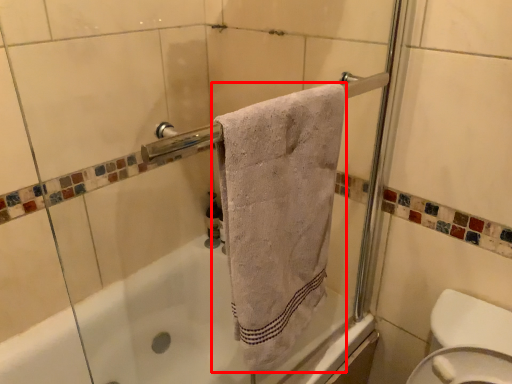
Question: From the image, what is the correct spatial relationship of towel (annotated by the red box) in relation to toiletry?

Choices:
 (A) left
 (B) right

Answer: (B)